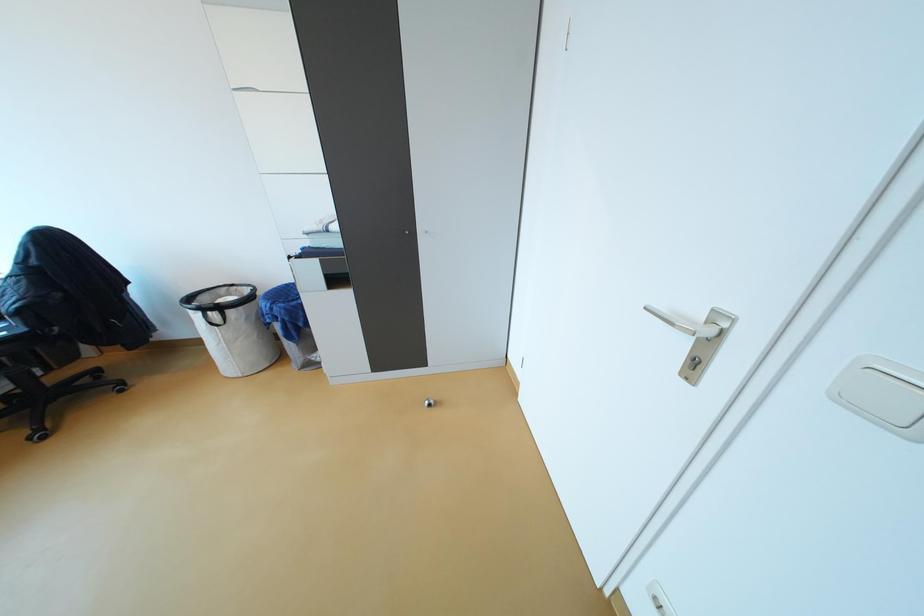
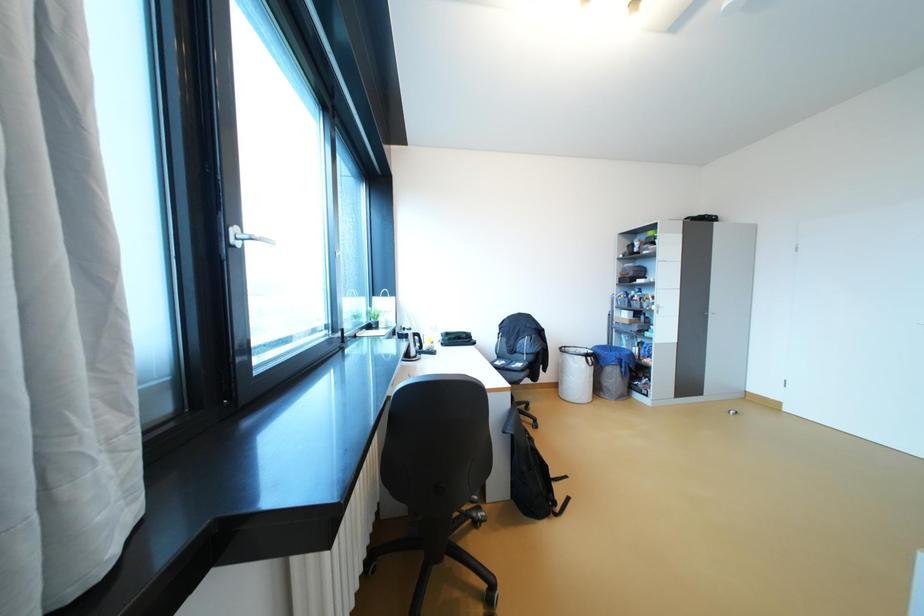
In a continuous first-person perspective shot, in which direction is the camera moving?

The cameraman moved toward left, backward.